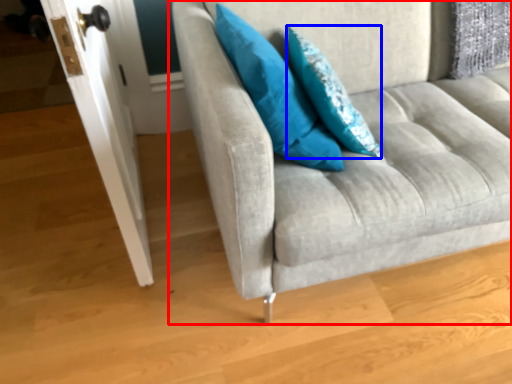
Question: Which of the following is the closest to the observer, studio couch (highlighted by a red box) or pillow (highlighted by a blue box)?

Choices:
 (A) studio couch
 (B) pillow

Answer: (A)